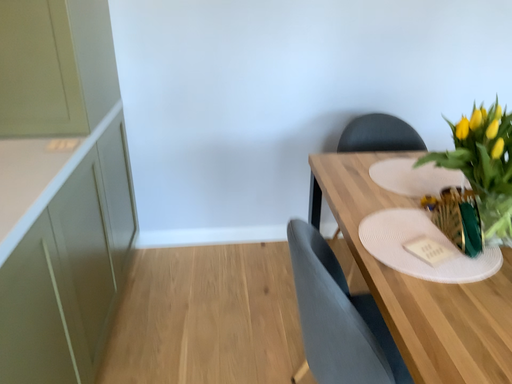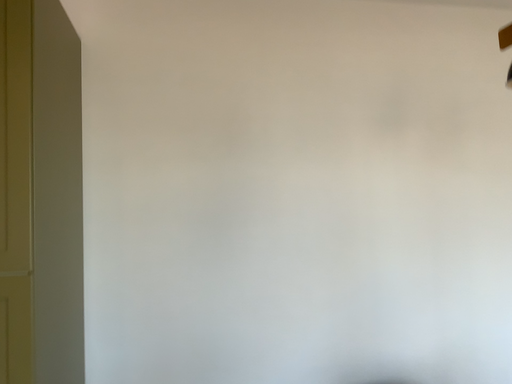
Question: How did the camera likely rotate when shooting the video?

Choices:
 (A) rotated upward
 (B) rotated downward

Answer: (A)